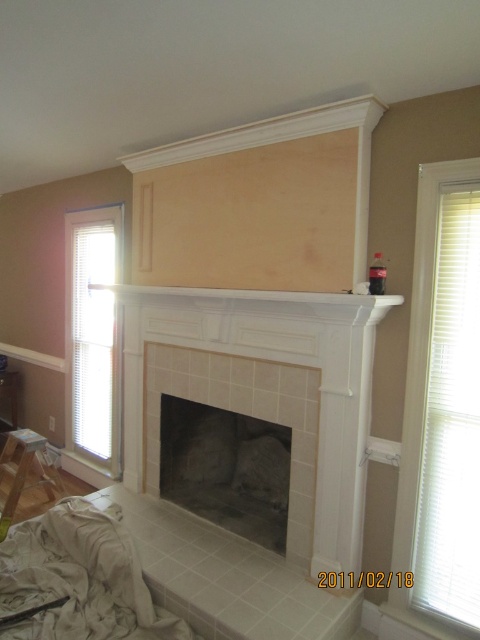
Question: Which point is closer to the camera?

Choices:
 (A) white blinds at right
 (B) white tile fireplace at center

Answer: (A)

Question: Considering the relative positions of white tile fireplace at center and white blinds at right in the image provided, where is white tile fireplace at center located with respect to white blinds at right?

Choices:
 (A) above
 (B) below

Answer: (B)

Question: Among these points, which one is farthest from the camera?

Choices:
 (A) (257, 476)
 (B) (97, 305)
 (C) (454, 417)
 (D) (359, 352)

Answer: (B)

Question: Does white tile fireplace at center have a lesser width compared to gray stone fireplace at center?

Choices:
 (A) no
 (B) yes

Answer: (A)

Question: Can you confirm if white tile fireplace at center is thinner than white blinds at left?

Choices:
 (A) yes
 (B) no

Answer: (B)

Question: Which of the following is the closest to the observer?

Choices:
 (A) (324, 563)
 (B) (403, 448)

Answer: (B)